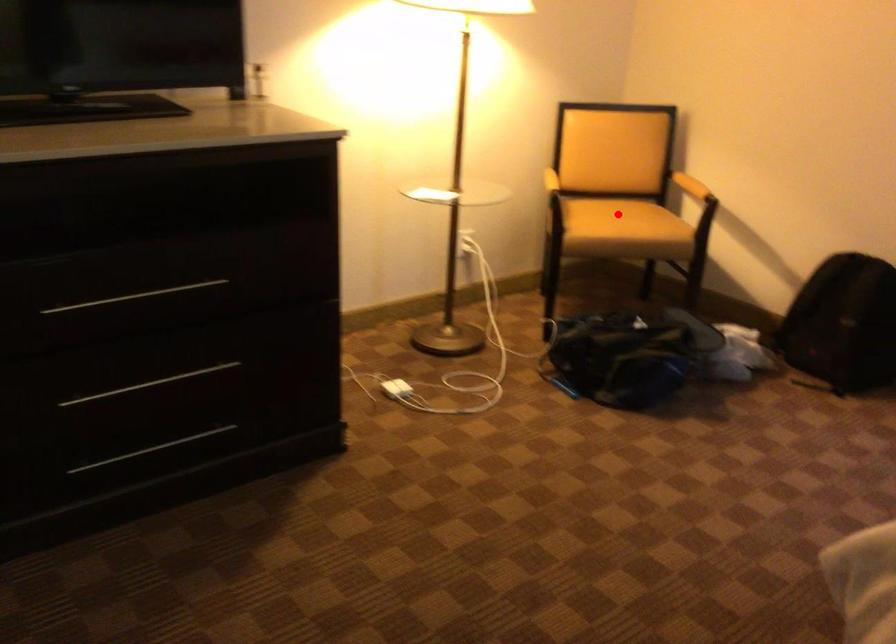
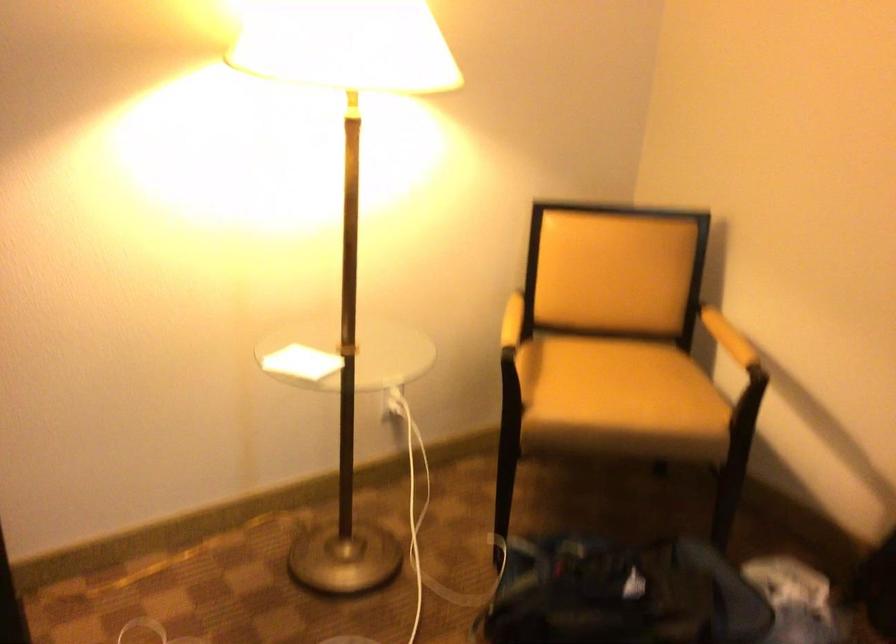
Question: I am providing you with two images of the same scene from different viewpoints. Image1 has a red point marked. In image2, the corresponding 3D location appears at what relative position? Reply with the corresponding letter.

Choices:
 (A) Closer
 (B) Farther

Answer: (A)